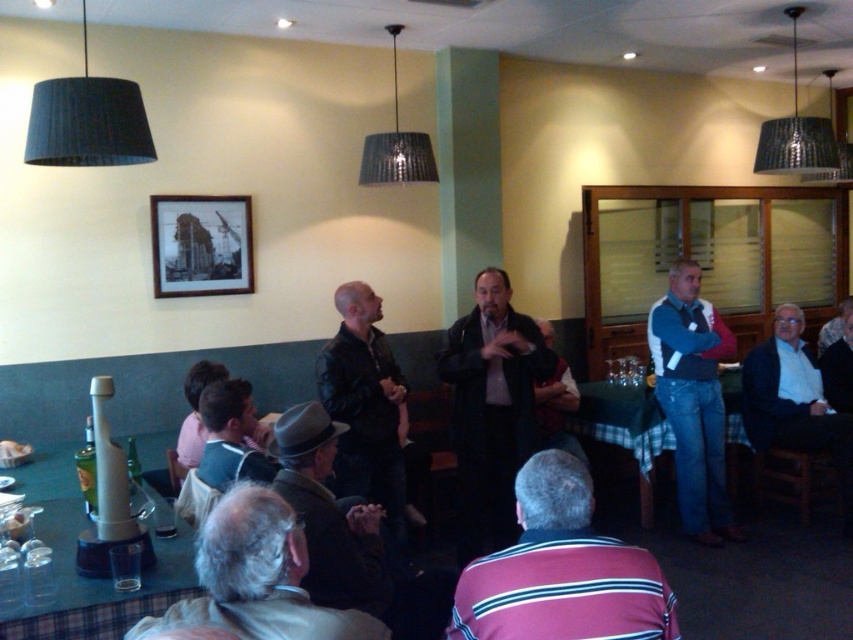
Consider the image. You are a photographer trying to capture both the black wood picture frame at upper center and the green plaid tablecloth at lower right in a single shot. Which object should you focus on first to ensure both are in frame?

The black wood picture frame at upper center has a lesser width compared to the green plaid tablecloth at lower right, so you should focus on the black wood picture frame at upper center first to ensure both fit within the camera frame.